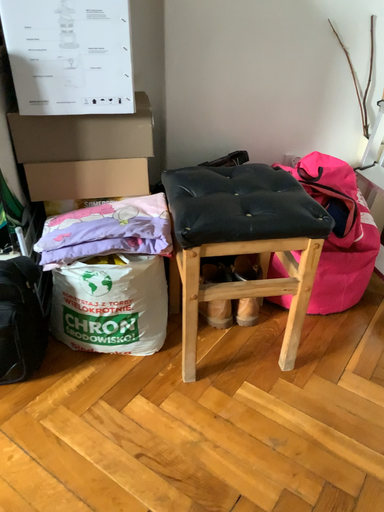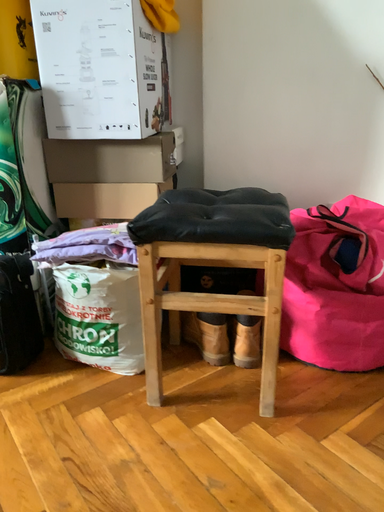
Question: Which way did the camera rotate in the video?

Choices:
 (A) rotated right
 (B) rotated left

Answer: (B)